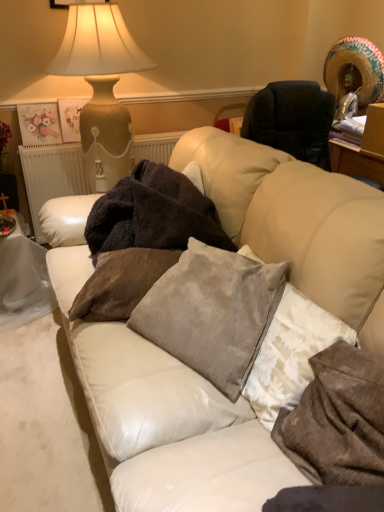
Question: From a real-world perspective, is velvet gray pillow at center, marked as the 2th pillow in a left-to-right arrangement, on top of velvet brown pillow at center, the third pillow from the right?

Choices:
 (A) no
 (B) yes

Answer: (B)

Question: From a real-world perspective, is velvet gray pillow at center, arranged as the second pillow when viewed from the right, under velvet brown pillow at center, the first pillow positioned from the left?

Choices:
 (A) yes
 (B) no

Answer: (B)

Question: Does velvet gray pillow at center, marked as the 2th pillow in a left-to-right arrangement, contain velvet brown pillow at center, the first pillow positioned from the left?

Choices:
 (A) no
 (B) yes

Answer: (A)

Question: From the image's perspective, is velvet gray pillow at center, marked as the 2th pillow in a left-to-right arrangement, on top of velvet brown pillow at center, the first pillow positioned from the left?

Choices:
 (A) no
 (B) yes

Answer: (A)

Question: Considering the relative positions of velvet gray pillow at center, marked as the 2th pillow in a left-to-right arrangement, and velvet brown pillow at center, the third pillow from the right, in the image provided, is velvet gray pillow at center, marked as the 2th pillow in a left-to-right arrangement, to the right of velvet brown pillow at center, the third pillow from the right, from the viewer's perspective?

Choices:
 (A) yes
 (B) no

Answer: (A)

Question: Is point (360, 473) closer or farther from the camera than point (114, 236)?

Choices:
 (A) closer
 (B) farther

Answer: (A)

Question: From a real-world perspective, relative to dark brown plush blanket at center, is white textured pillow at lower right, marked as the 3th pillow in a left-to-right arrangement, vertically above or below?

Choices:
 (A) above
 (B) below

Answer: (B)

Question: Relative to dark brown plush blanket at center, is white textured pillow at lower right, marked as the 3th pillow in a left-to-right arrangement, in front or behind?

Choices:
 (A) front
 (B) behind

Answer: (A)

Question: Looking at the image, does white textured pillow at lower right, marked as the 3th pillow in a left-to-right arrangement, seem bigger or smaller compared to dark brown plush blanket at center?

Choices:
 (A) big
 (B) small

Answer: (B)

Question: Considering the relative positions of dark brown plush blanket at center and matte beige ceramic table lamp at upper left in the image provided, is dark brown plush blanket at center to the left or to the right of matte beige ceramic table lamp at upper left?

Choices:
 (A) left
 (B) right

Answer: (B)

Question: From a real-world perspective, is dark brown plush blanket at center above or below matte beige ceramic table lamp at upper left?

Choices:
 (A) above
 (B) below

Answer: (B)

Question: Is point (231, 245) closer or farther from the camera than point (46, 72)?

Choices:
 (A) closer
 (B) farther

Answer: (A)

Question: Is dark brown plush blanket at center wider or thinner than matte beige ceramic table lamp at upper left?

Choices:
 (A) wide
 (B) thin

Answer: (B)

Question: Considering their positions, is velvet gray pillow at center, arranged as the second pillow when viewed from the right, located in front of or behind dark brown plush blanket at center?

Choices:
 (A) front
 (B) behind

Answer: (A)

Question: Considering the positions of velvet gray pillow at center, arranged as the second pillow when viewed from the right, and dark brown plush blanket at center in the image, is velvet gray pillow at center, arranged as the second pillow when viewed from the right, taller or shorter than dark brown plush blanket at center?

Choices:
 (A) tall
 (B) short

Answer: (B)